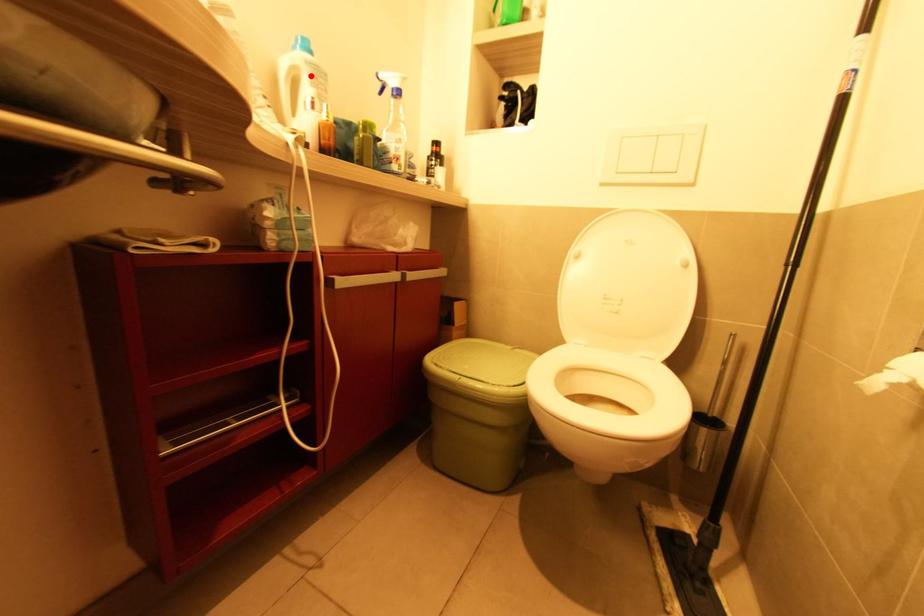
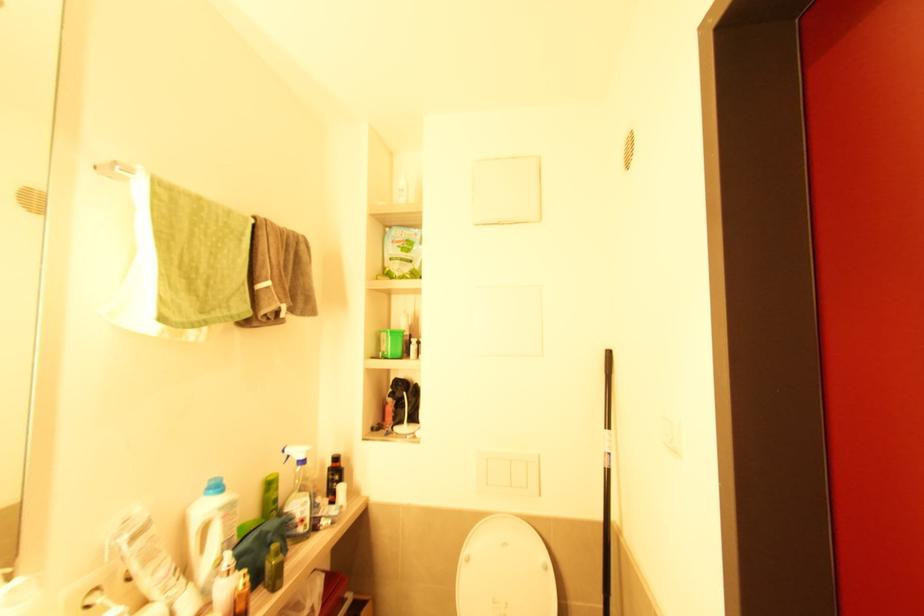
Locate, in the second image, the point that corresponds to the highlighted location in the first image.

(224, 519)